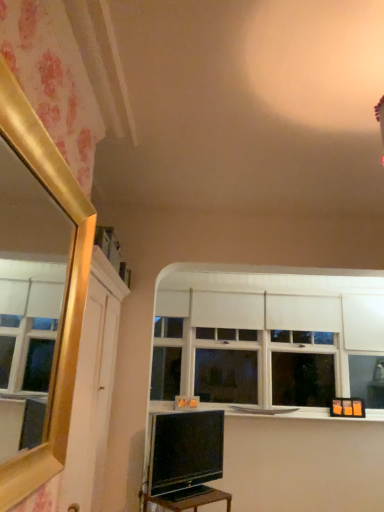
Identify the location of free space above white matte window sill at center (from a real-world perspective). (280, 413).